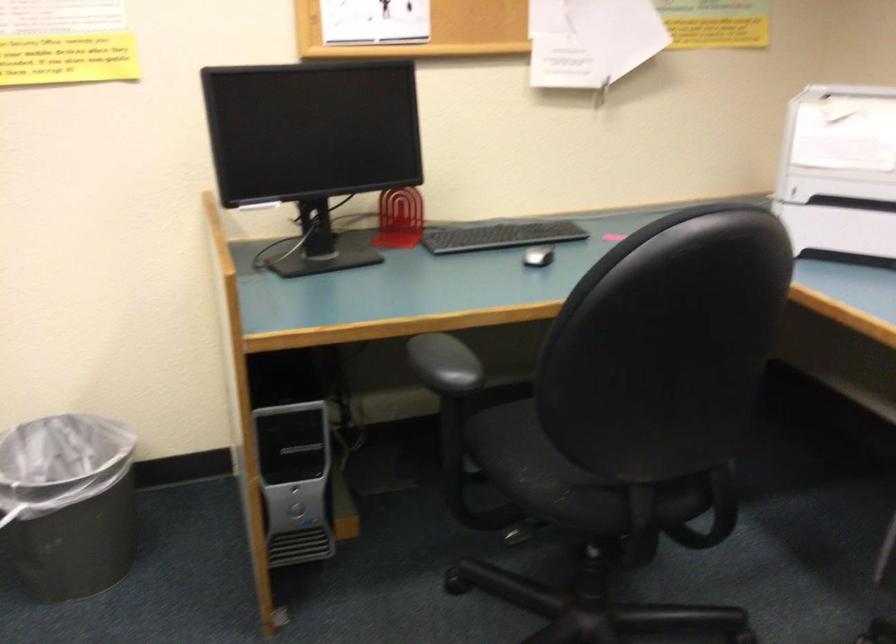
At what (x,y) coordinates should I click in order to perform the action: click on black chair armrest. Please return your answer as a coordinate pair (x, y). This screenshot has width=896, height=644. Looking at the image, I should click on (445, 365).